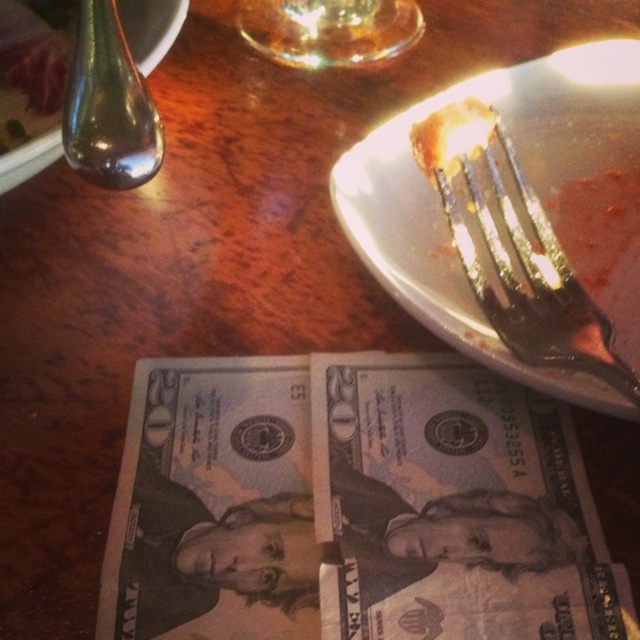
Question: Which of the following is the farthest from the observer?

Choices:
 (A) metallic silver fork at upper right
 (B) transparent glass at upper center
 (C) metallic spoon at upper left

Answer: (B)

Question: Is metallic silver fork at upper right bigger than metallic spoon at upper left?

Choices:
 (A) no
 (B) yes

Answer: (B)

Question: Which point is farther to the camera?

Choices:
 (A) metallic silver fork at upper right
 (B) metallic spoon at upper left

Answer: (B)

Question: Which point is farther to the camera?

Choices:
 (A) transparent glass at upper center
 (B) metallic silver fork at upper right

Answer: (A)

Question: Does transparent glass at upper center appear on the right side of metallic spoon at upper left?

Choices:
 (A) no
 (B) yes

Answer: (B)

Question: Is metallic silver fork at upper right below metallic spoon at upper left?

Choices:
 (A) yes
 (B) no

Answer: (A)